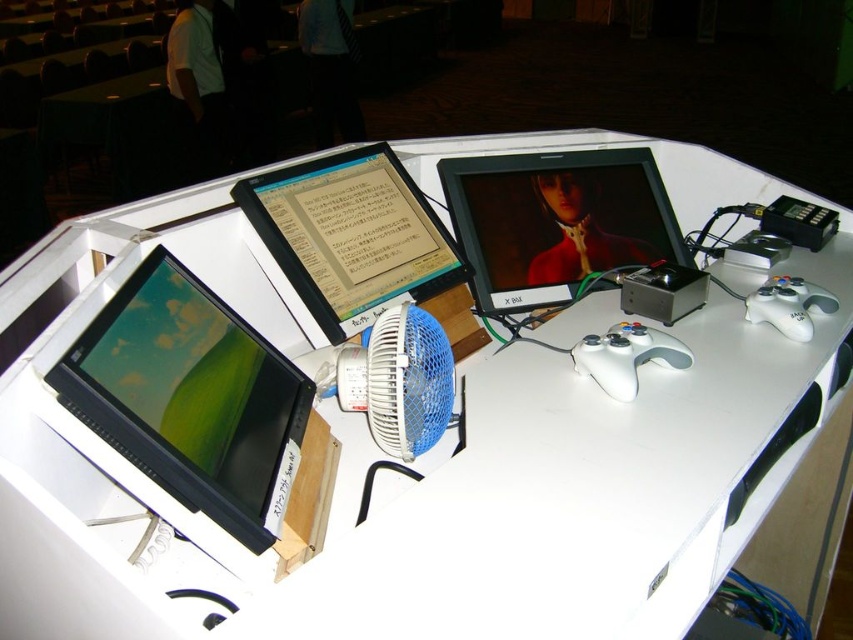
Question: Is matte black monitor at lower left smaller than blue plastic fan at center?

Choices:
 (A) no
 (B) yes

Answer: (A)

Question: Which point appears closest to the camera in this image?

Choices:
 (A) (282, 296)
 (B) (233, 532)
 (C) (630, 161)

Answer: (B)

Question: Estimate the real-world distances between objects in this image. Which object is farther from the blue plastic fan at center?

Choices:
 (A) matte black monitor at lower left
 (B) matte black monitor at upper center

Answer: (A)

Question: Is matte black monitor at center to the left of matte black monitor at upper center from the viewer's perspective?

Choices:
 (A) yes
 (B) no

Answer: (B)

Question: Does matte black monitor at lower left have a lesser width compared to blue plastic fan at center?

Choices:
 (A) yes
 (B) no

Answer: (B)

Question: Which point appears farthest from the camera in this image?

Choices:
 (A) (392, 323)
 (B) (611, 195)
 (C) (245, 188)
 (D) (154, 337)

Answer: (B)